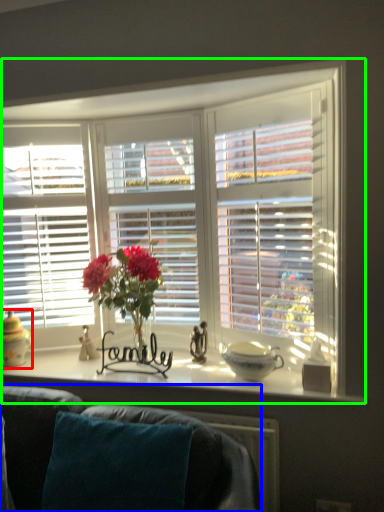
Question: Which object is the closest to the candle holder (highlighted by a red box)? Choose among these: studio couch (highlighted by a blue box) or window (highlighted by a green box).

Choices:
 (A) studio couch
 (B) window

Answer: (A)